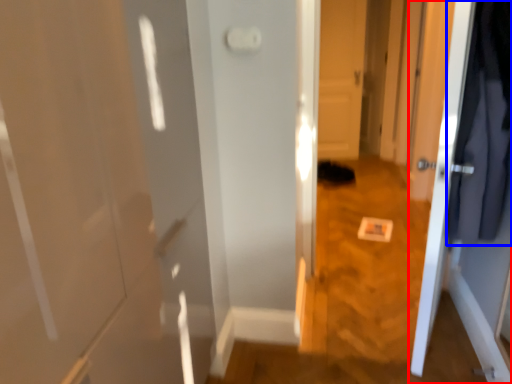
Question: Which object is closer to the camera taking this photo, door (highlighted by a red box) or clothing (highlighted by a blue box)?

Choices:
 (A) door
 (B) clothing

Answer: (B)